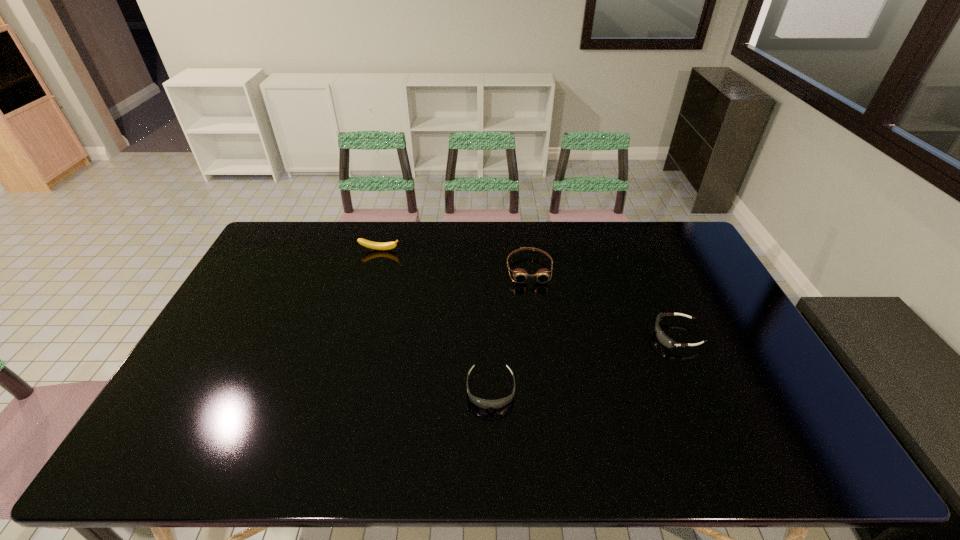
The height and width of the screenshot is (540, 960). I want to click on the farthest object, so click(366, 243).

Locate an element on the screen. This screenshot has height=540, width=960. banana is located at coordinates [366, 243].

Find the location of `the tallest goggles`. the tallest goggles is located at coordinates (520, 275).

Locate an element on the screen. This screenshot has width=960, height=540. the second goggles from left to right is located at coordinates (520, 275).

I want to click on the nearest object, so click(x=482, y=403).

Locate an element on the screen. This screenshot has width=960, height=540. the leftmost goggles is located at coordinates (482, 403).

I want to click on the second nearest object, so (661, 336).

Where is `the second farthest goggles`? The height and width of the screenshot is (540, 960). the second farthest goggles is located at coordinates (661, 336).

The height and width of the screenshot is (540, 960). I want to click on vacant point located 0.160m at the stem of the leftmost object, so click(x=371, y=282).

Find the location of a particular element. This screenshot has width=960, height=540. free space located through the lenses of the tallest goggles is located at coordinates (538, 330).